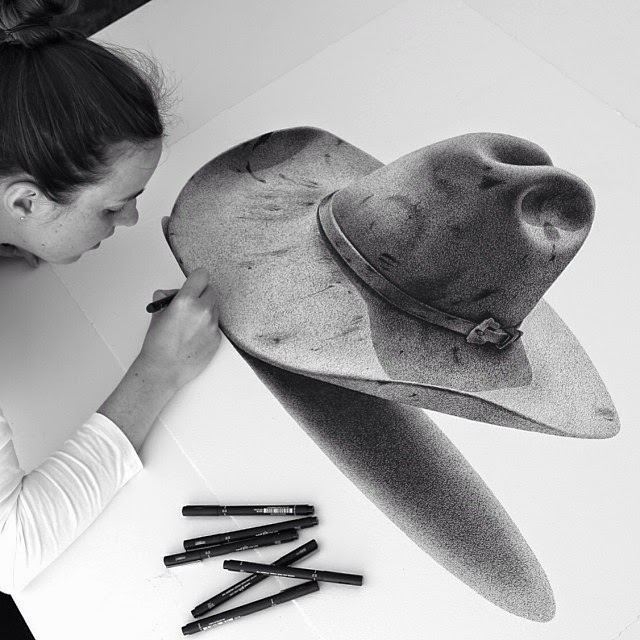
Image resolution: width=640 pixels, height=640 pixels. Find the location of `white canvas`. white canvas is located at coordinates (292, 452).